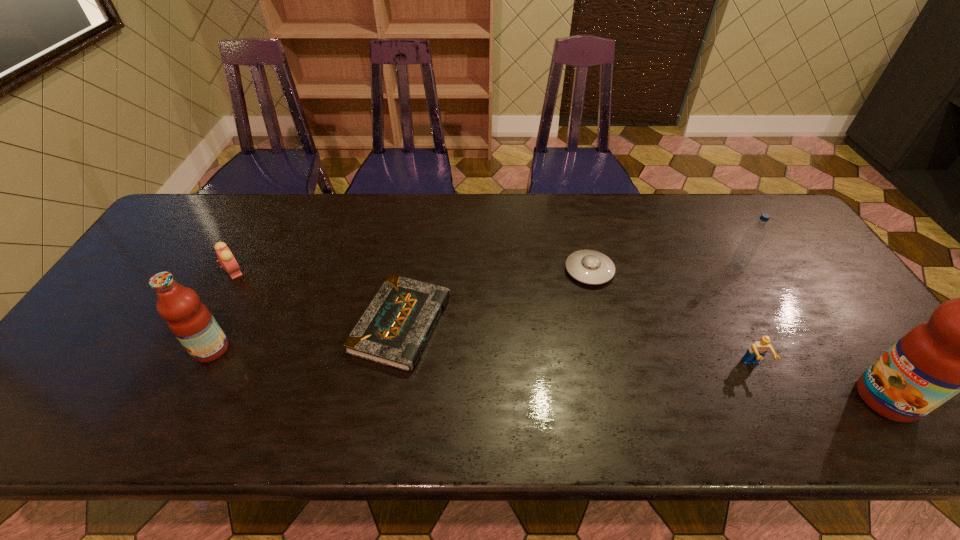
This screenshot has height=540, width=960. What are the coordinates of `vacant area between the nearer fruit juice and the saucer` in the screenshot? It's located at (738, 334).

Locate which object ranks sixth in proximity to the alarm clock. Please provide its 2D coordinates. Your answer should be formatted as a tuple, i.e. [(x, y)], where the tuple contains the x and y coordinates of a point satisfying the conditions above.

[(959, 349)]

Select which object is the fifth closest to the water bottle. Please provide its 2D coordinates. Your answer should be formatted as a tuple, i.e. [(x, y)], where the tuple contains the x and y coordinates of a point satisfying the conditions above.

[(191, 322)]

Where is `free space that satisfies the following two spatial constraints: 1. on the front side of the sixth object from left to right; 2. on the face of the alarm clock`? This screenshot has width=960, height=540. free space that satisfies the following two spatial constraints: 1. on the front side of the sixth object from left to right; 2. on the face of the alarm clock is located at coordinates (740, 272).

Find the location of a particular element. The width and height of the screenshot is (960, 540). vacant area that satisfies the following two spatial constraints: 1. on the face of the alarm clock; 2. on the right side of the third object from left to right is located at coordinates (205, 324).

What are the coordinates of `vacant region that satisfies the following two spatial constraints: 1. on the front side of the fifth shortest object; 2. on the front label of the left fruit juice` in the screenshot? It's located at [x=785, y=349].